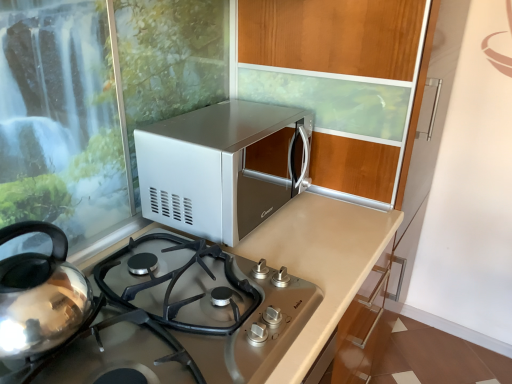
Question: Should I look upward or downward to see satin silver gas stove at center?

Choices:
 (A) down
 (B) up

Answer: (A)

Question: From a real-world perspective, does satin silver gas stove at center sit lower than satin silver microwave at upper center?

Choices:
 (A) yes
 (B) no

Answer: (A)

Question: Can you see satin silver gas stove at center touching satin silver microwave at upper center?

Choices:
 (A) no
 (B) yes

Answer: (A)

Question: Considering the relative sizes of satin silver gas stove at center and satin silver microwave at upper center in the image provided, is satin silver gas stove at center wider than satin silver microwave at upper center?

Choices:
 (A) no
 (B) yes

Answer: (B)

Question: Does satin silver gas stove at center have a greater height compared to satin silver microwave at upper center?

Choices:
 (A) yes
 (B) no

Answer: (B)

Question: Can you confirm if satin silver gas stove at center is positioned to the left of satin silver microwave at upper center?

Choices:
 (A) yes
 (B) no

Answer: (A)

Question: Is satin silver gas stove at center positioned behind satin silver microwave at upper center?

Choices:
 (A) yes
 (B) no

Answer: (B)

Question: Is satin silver gas stove at center surrounded by satin silver microwave at upper center?

Choices:
 (A) no
 (B) yes

Answer: (A)

Question: Is satin silver microwave at upper center wider than satin silver gas stove at center?

Choices:
 (A) no
 (B) yes

Answer: (A)

Question: Considering the relative sizes of satin silver microwave at upper center and satin silver gas stove at center in the image provided, is satin silver microwave at upper center smaller than satin silver gas stove at center?

Choices:
 (A) yes
 (B) no

Answer: (B)

Question: Does satin silver microwave at upper center turn towards satin silver gas stove at center?

Choices:
 (A) yes
 (B) no

Answer: (B)

Question: Is satin silver microwave at upper center looking in the opposite direction of satin silver gas stove at center?

Choices:
 (A) no
 (B) yes

Answer: (A)

Question: Considering the relative positions of satin silver microwave at upper center and satin silver gas stove at center in the image provided, is satin silver microwave at upper center to the right of satin silver gas stove at center from the viewer's perspective?

Choices:
 (A) no
 (B) yes

Answer: (B)

Question: Based on their positions, is satin silver microwave at upper center located to the left or right of satin silver gas stove at center?

Choices:
 (A) left
 (B) right

Answer: (B)